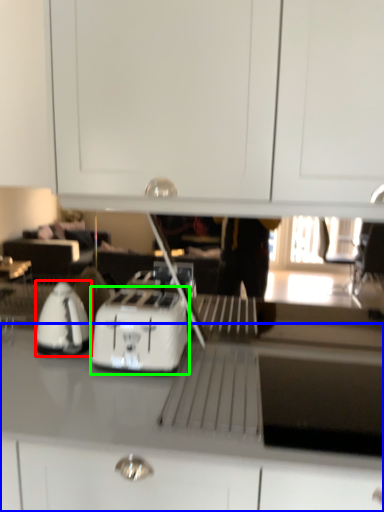
Question: Which object is the closest to the home appliance (highlighted by a red box)? Choose among these: countertop (highlighted by a blue box) or kitchen appliance (highlighted by a green box).

Choices:
 (A) countertop
 (B) kitchen appliance

Answer: (B)